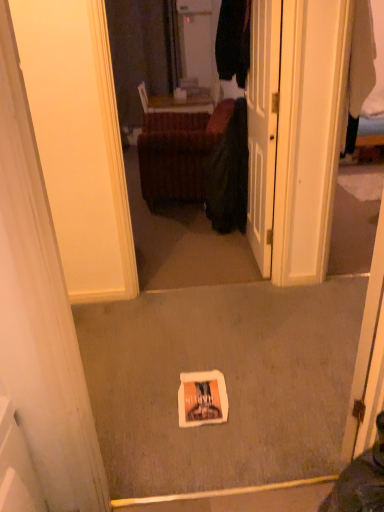
Identify the location of free space in front of velvet brown ottoman at center. (163, 219).